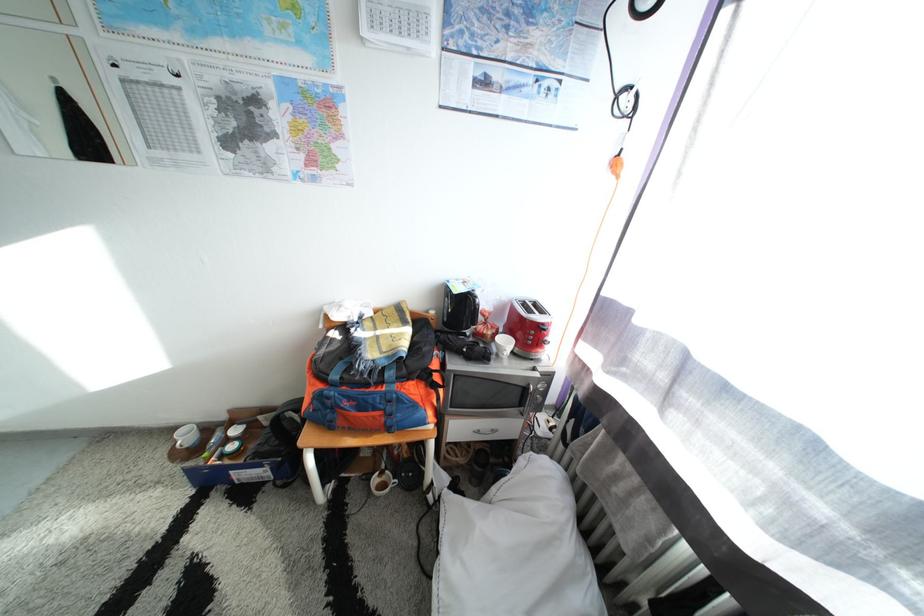
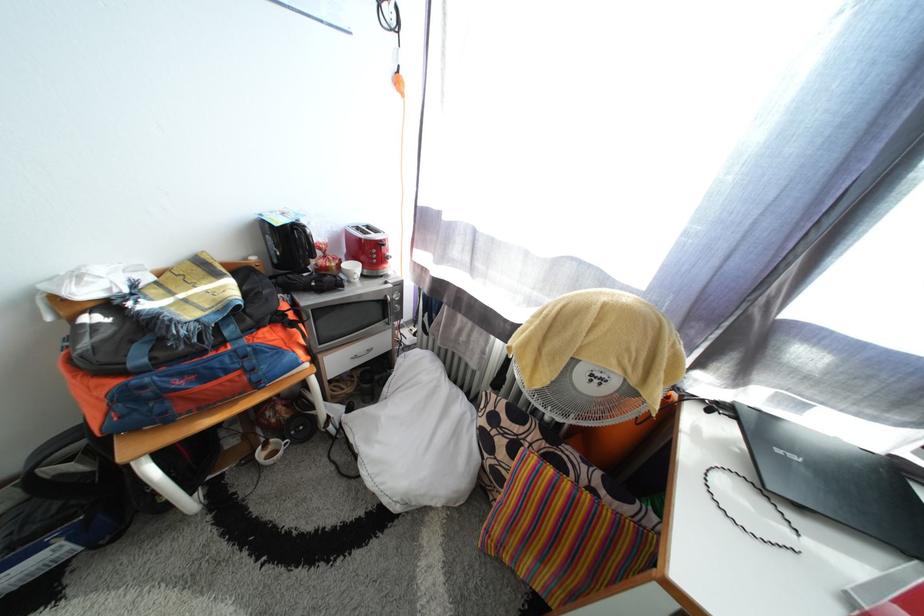
Where in the second image is the point corresponding to point 545,381 from the first image?

(398, 293)